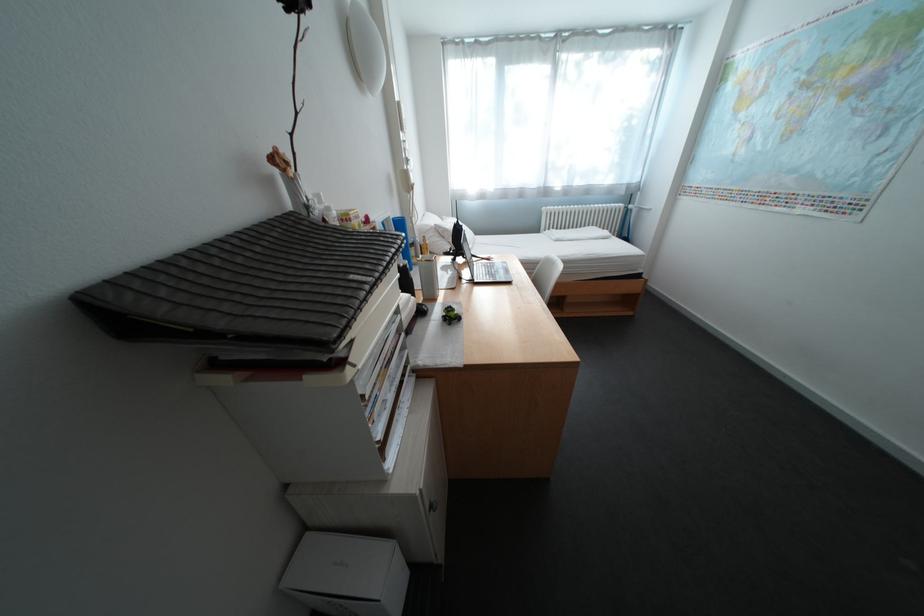
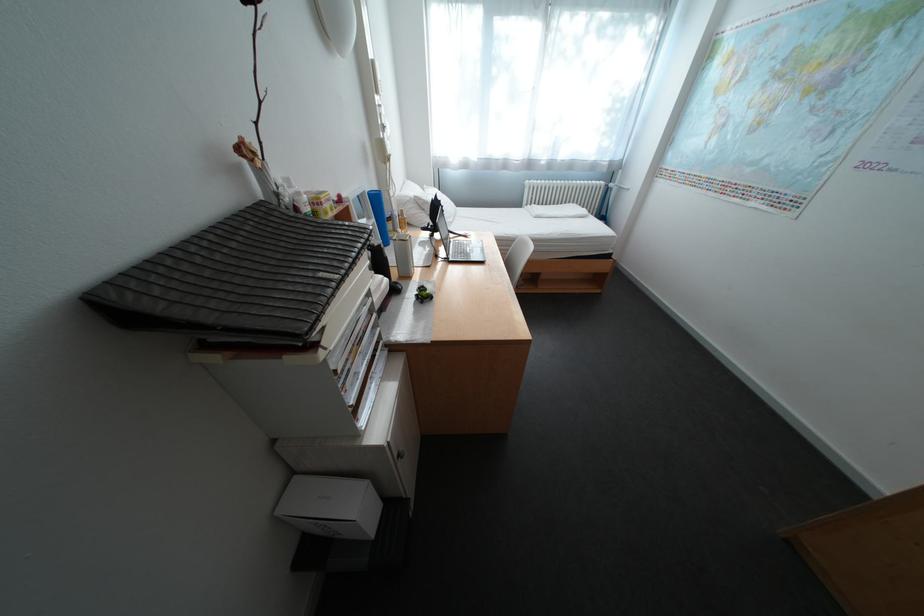
Question: I am providing you with two images of the same scene from different viewpoints. Which of the following objects are not visible in image2?

Choices:
 (A) small toy motorcycle
 (B) laptop lid
 (C) white pillow
 (D) none of these

Answer: (D)